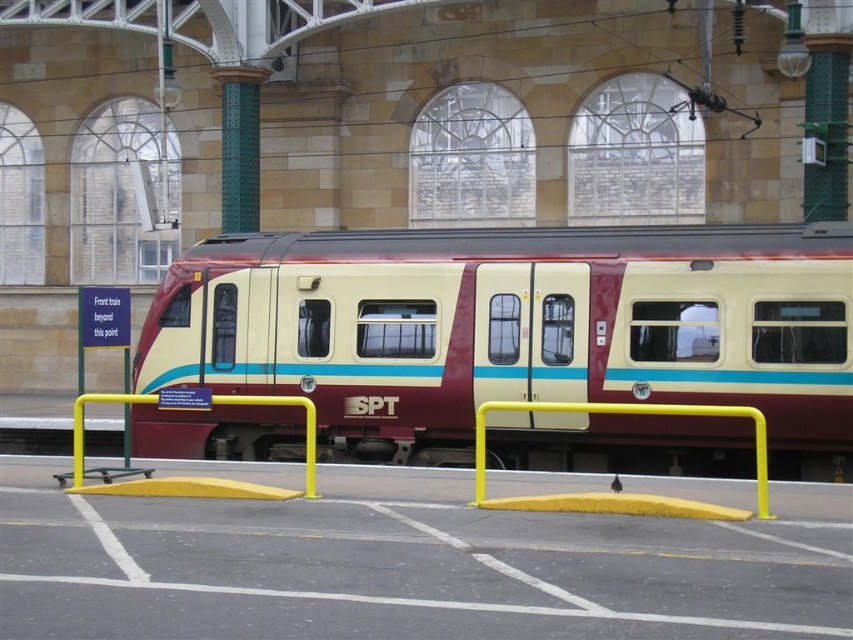
Question: Does maroon matte train at center have a larger size compared to yellow matte rail at center?

Choices:
 (A) yes
 (B) no

Answer: (B)

Question: Among these objects, which one is nearest to the camera?

Choices:
 (A) maroon matte train at center
 (B) yellow rubber curb at center
 (C) yellow matte rail at center

Answer: (C)

Question: Which point is closer to the camera?

Choices:
 (A) (598, 432)
 (B) (566, 500)
 (C) (397, 564)

Answer: (C)

Question: Can you confirm if maroon matte train at center is positioned to the left of yellow matte rail at center?

Choices:
 (A) yes
 (B) no

Answer: (A)

Question: Which point is closer to the camera?

Choices:
 (A) maroon matte train at center
 (B) yellow matte rail at center

Answer: (B)

Question: Does maroon matte train at center appear on the right side of yellow matte rail at center?

Choices:
 (A) yes
 (B) no

Answer: (B)